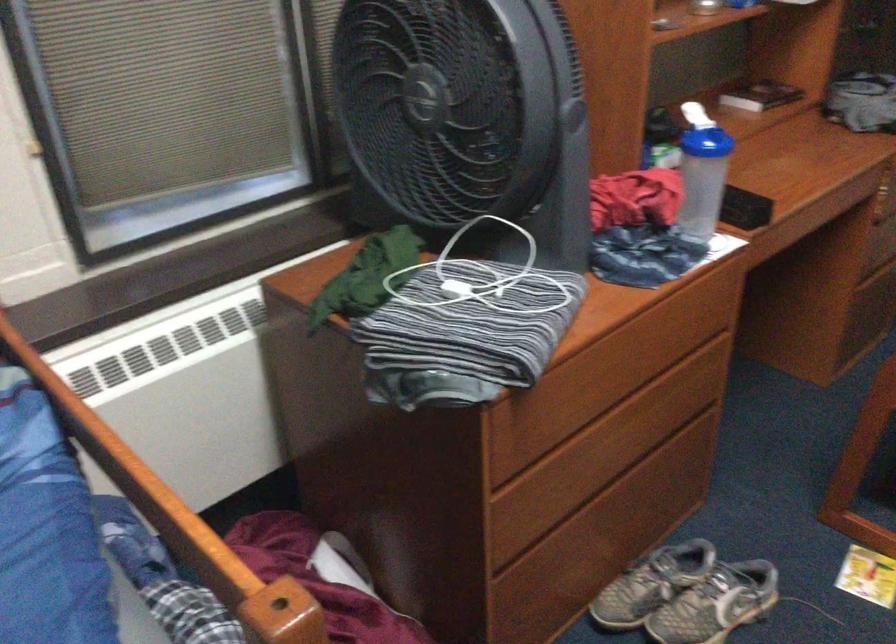
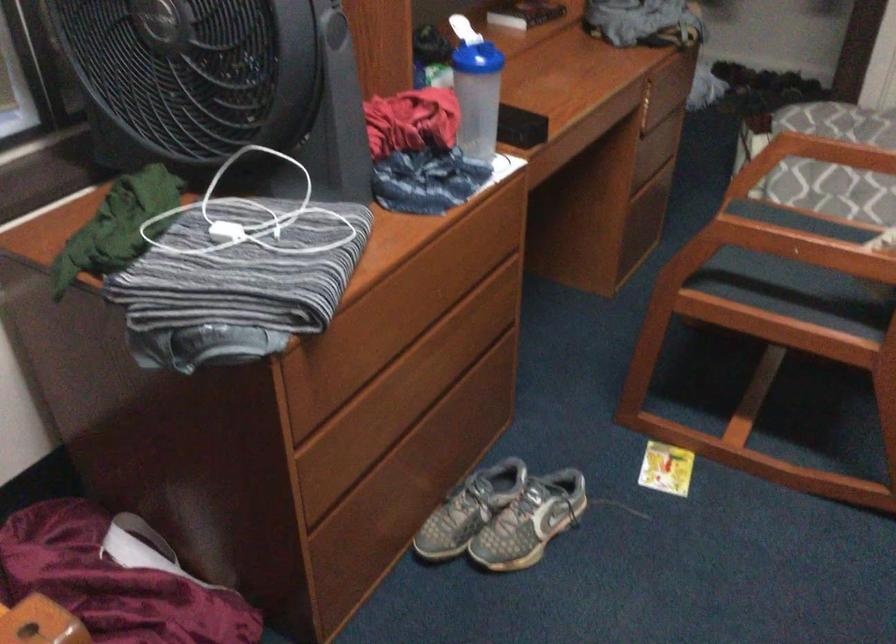
Question: Based on the continuous images, in which direction is the camera rotating? Reply with the corresponding letter.

Choices:
 (A) Left
 (B) Right
 (C) Up
 (D) Down

Answer: (B)